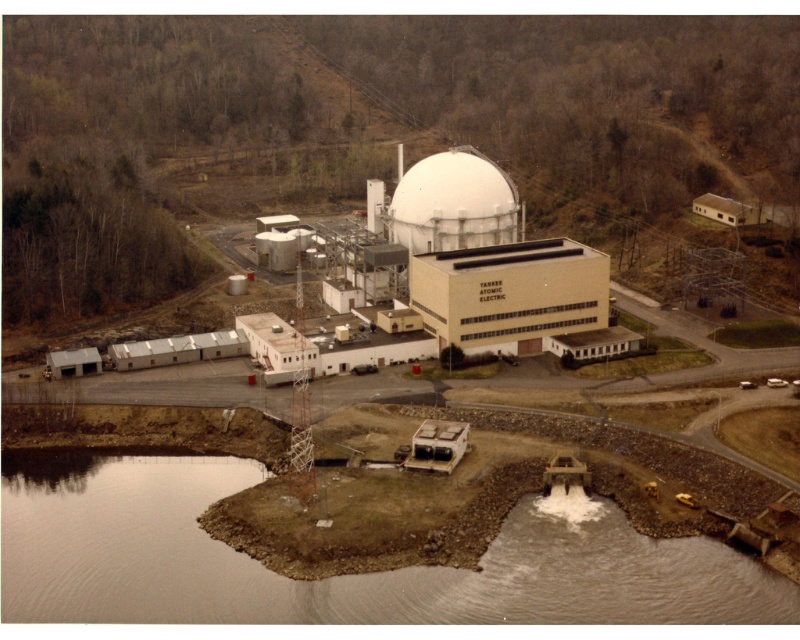
You are a drone operator tasked with capturing aerial footage of the nuclear power plant. Your drone is currently at the smooth concrete dam at lower center. To ensure safety, you need to ascend vertically until you are at least 100 meters above the dam. What coordinate point should you target for your drone to safely capture the entire plant from above?

The smooth concrete dam at lower center is located at coordinate point (341, 576). To ascend vertically 100 meters above this point, the target coordinate should be (341, 576), 100. This ensures the drone is positioned directly above the dam at a safe elevation to capture the entire plant.

You are a drone operator flying over the nuclear power plant. Your drone is currently at the smooth concrete dam at lower center. You need to capture a photo of the white matte building at center. Since the dam is blocking your view, you decide to fly over it. How should you adjust your flight path to ensure the building is visible in your shot?

Since the smooth concrete dam at lower center is closer to the viewer than the white matte building at center, you should fly your drone upwards to elevate above the dam and then position it so that the white matte building at center comes into view behind the dam. This way, the dam will no longer block the building from your camera.

You are a drone operator tasked with inspecting the nuclear power plant from an aerial view. You must determine if the smooth concrete dam at lower center can be seen over the top of the white matte dome at center. Based on their heights, can you confirm if the dam is visible above the dome?

The smooth concrete dam at lower center is not as tall as the white matte dome at center, so the dam cannot be seen over the top of the dome from an aerial view.